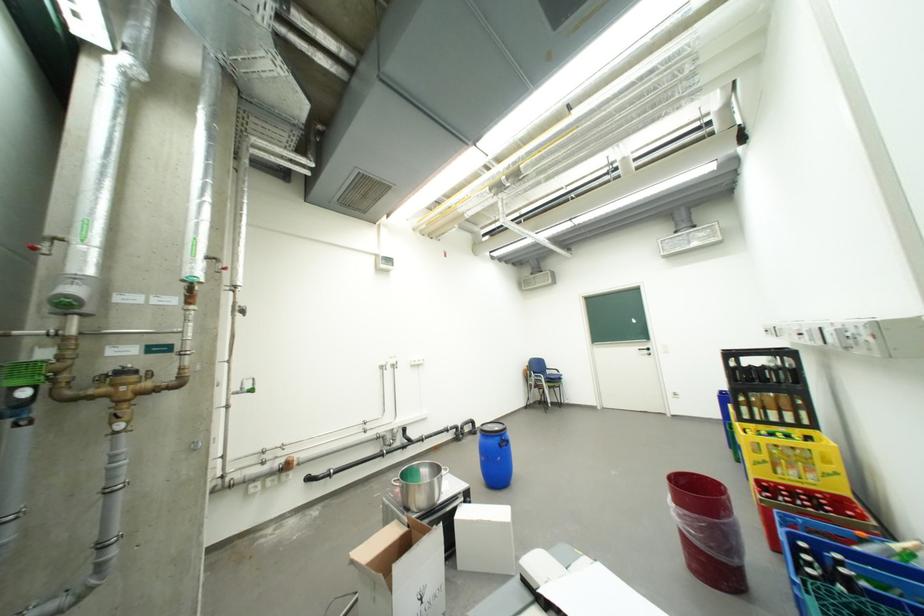
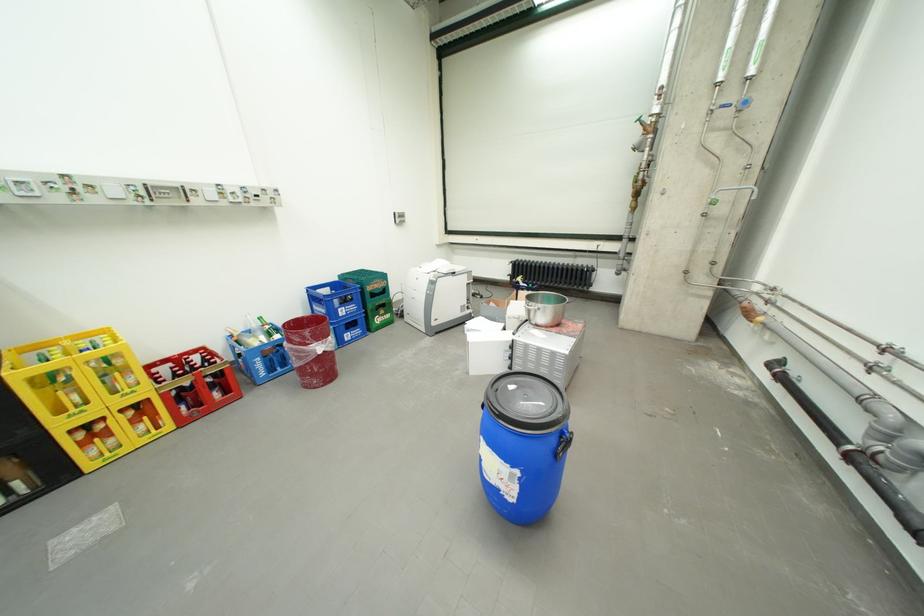
The point at (748, 427) is marked in the first image. Where is the corresponding point in the second image?

(30, 374)